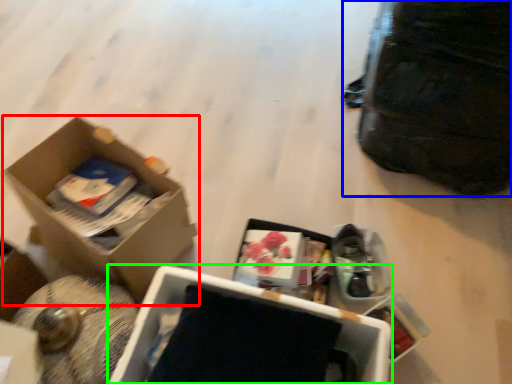
Question: Based on their relative distances, which object is nearer to box (highlighted by a red box)? Choose from bag (highlighted by a blue box) and box (highlighted by a green box).

Choices:
 (A) bag
 (B) box

Answer: (B)